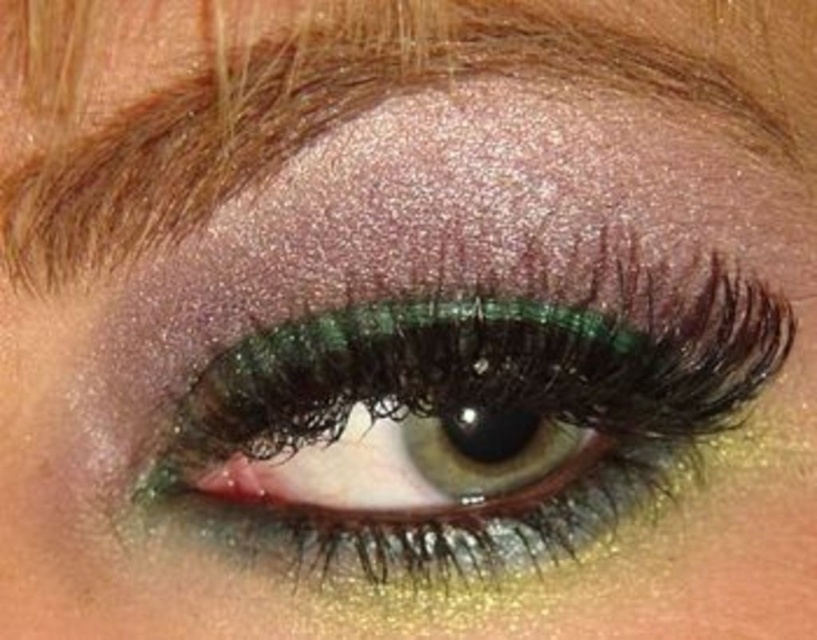
Question: Which point is farther to the camera?

Choices:
 (A) shiny green eyeliner at center
 (B) shiny brown eyebrow at upper center

Answer: (A)

Question: Among these points, which one is farthest from the camera?

Choices:
 (A) (708, 378)
 (B) (34, 204)

Answer: (A)

Question: Is shiny green eyeliner at center positioned behind shiny brown eyebrow at upper center?

Choices:
 (A) yes
 (B) no

Answer: (A)

Question: Does shiny green eyeliner at center lie in front of shiny brown eyebrow at upper center?

Choices:
 (A) no
 (B) yes

Answer: (A)

Question: Can you confirm if shiny green eyeliner at center is positioned to the left of shiny brown eyebrow at upper center?

Choices:
 (A) no
 (B) yes

Answer: (A)

Question: Which object is closer to the camera taking this photo?

Choices:
 (A) shiny green eyeliner at center
 (B) shiny brown eyebrow at upper center

Answer: (B)